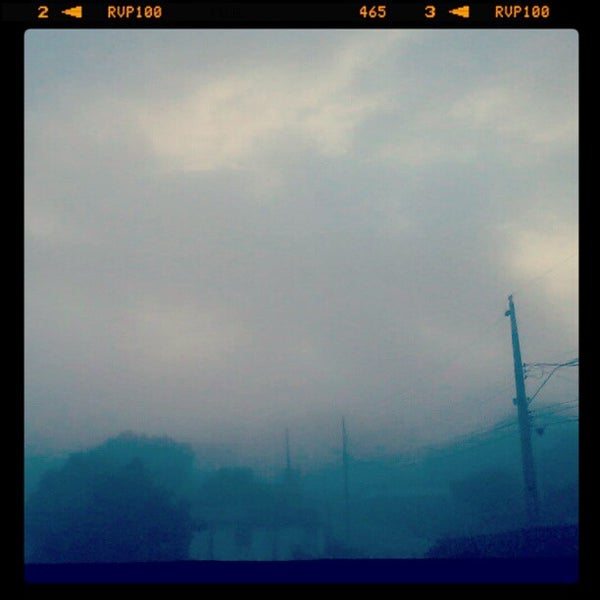
The image size is (600, 600). I want to click on cable, so click(559, 423).